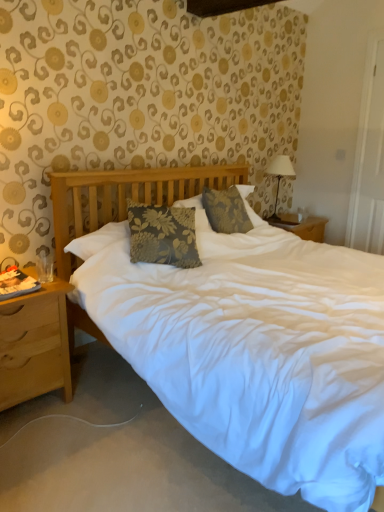
Question: Would you say wooden nightstand at left is to the left or to the right of white fabric-covered lampshade at upper right in the picture?

Choices:
 (A) right
 (B) left

Answer: (B)

Question: From the image's perspective, is wooden nightstand at left above or below white fabric-covered lampshade at upper right?

Choices:
 (A) above
 (B) below

Answer: (B)

Question: Estimate the real-world distances between objects in this image. Which object is farther from the white fabric-covered lampshade at upper right?

Choices:
 (A) floral fabric pillow at center
 (B) wooden nightstand at left

Answer: (B)

Question: Estimate the real-world distances between objects in this image. Which object is farther from the white fabric-covered lampshade at upper right?

Choices:
 (A) floral fabric pillow at center
 (B) wooden nightstand at left

Answer: (B)